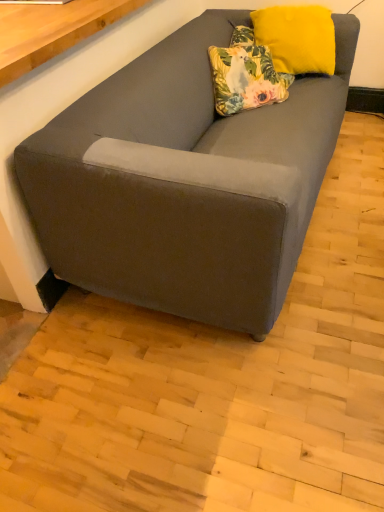
Question: Considering the relative sizes of suede gray couch at lower left and floral fabric pillow at upper center, the second pillow viewed from the right, in the image provided, is suede gray couch at lower left thinner than floral fabric pillow at upper center, the second pillow viewed from the right,?

Choices:
 (A) no
 (B) yes

Answer: (A)

Question: Is suede gray couch at lower left shorter than floral fabric pillow at upper center, the second pillow viewed from the right?

Choices:
 (A) yes
 (B) no

Answer: (B)

Question: Considering the relative positions of suede gray couch at lower left and floral fabric pillow at upper center, positioned as the 1th pillow in left-to-right order, in the image provided, is suede gray couch at lower left to the right of floral fabric pillow at upper center, positioned as the 1th pillow in left-to-right order, from the viewer's perspective?

Choices:
 (A) yes
 (B) no

Answer: (B)

Question: Is suede gray couch at lower left in front of floral fabric pillow at upper center, positioned as the 1th pillow in left-to-right order?

Choices:
 (A) no
 (B) yes

Answer: (B)

Question: Is floral fabric pillow at upper center, the second pillow viewed from the right, located within suede gray couch at lower left?

Choices:
 (A) yes
 (B) no

Answer: (B)

Question: From the image's perspective, relative to yellow velvet pillow at upper right, the second pillow from the left, is suede gray couch at lower left above or below?

Choices:
 (A) above
 (B) below

Answer: (B)

Question: Looking at their shapes, would you say suede gray couch at lower left is wider or thinner than yellow velvet pillow at upper right, the second pillow from the left?

Choices:
 (A) wide
 (B) thin

Answer: (A)

Question: Considering the positions of suede gray couch at lower left and yellow velvet pillow at upper right, the second pillow from the left, in the image, is suede gray couch at lower left taller or shorter than yellow velvet pillow at upper right, the second pillow from the left,?

Choices:
 (A) tall
 (B) short

Answer: (A)

Question: Visually, is suede gray couch at lower left positioned to the left or to the right of yellow velvet pillow at upper right, marked as the 1th pillow in a right-to-left arrangement?

Choices:
 (A) left
 (B) right

Answer: (A)

Question: From the image's perspective, is yellow velvet pillow at upper right, the second pillow from the left, positioned above or below floral fabric pillow at upper center, positioned as the 1th pillow in left-to-right order?

Choices:
 (A) below
 (B) above

Answer: (B)

Question: Considering their positions, is yellow velvet pillow at upper right, marked as the 1th pillow in a right-to-left arrangement, located in front of or behind floral fabric pillow at upper center, the second pillow viewed from the right?

Choices:
 (A) front
 (B) behind

Answer: (B)

Question: From a real-world perspective, is yellow velvet pillow at upper right, the second pillow from the left, positioned above or below floral fabric pillow at upper center, positioned as the 1th pillow in left-to-right order?

Choices:
 (A) above
 (B) below

Answer: (A)

Question: From their relative heights in the image, would you say yellow velvet pillow at upper right, marked as the 1th pillow in a right-to-left arrangement, is taller or shorter than floral fabric pillow at upper center, positioned as the 1th pillow in left-to-right order?

Choices:
 (A) tall
 (B) short

Answer: (A)

Question: From the image's perspective, is floral fabric pillow at upper center, the second pillow viewed from the right, located above or below suede gray couch at lower left?

Choices:
 (A) above
 (B) below

Answer: (A)

Question: Relative to suede gray couch at lower left, is floral fabric pillow at upper center, positioned as the 1th pillow in left-to-right order, in front or behind?

Choices:
 (A) behind
 (B) front

Answer: (A)